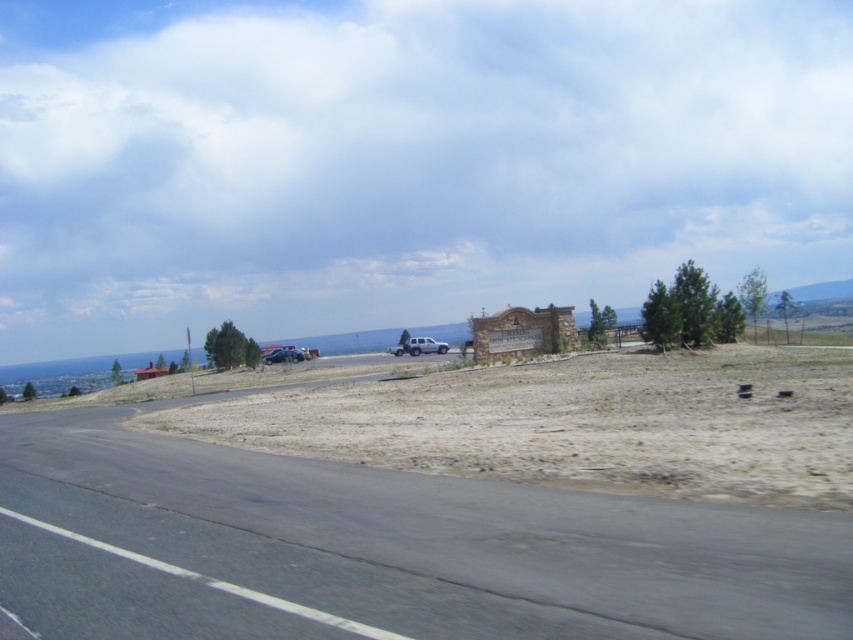
Question: Which point appears farthest from the camera in this image?

Choices:
 (A) pyautogui.click(x=61, y=490)
 (B) pyautogui.click(x=410, y=342)
 (C) pyautogui.click(x=276, y=349)

Answer: (C)

Question: Considering the relative positions of silver metallic truck at center and metallic blue truck at center in the image provided, where is silver metallic truck at center located with respect to metallic blue truck at center?

Choices:
 (A) right
 (B) left

Answer: (A)

Question: Is asphalt road at lower left above silver metallic truck at center?

Choices:
 (A) yes
 (B) no

Answer: (B)

Question: Estimate the real-world distances between objects in this image. Which object is closer to the metallic blue truck at center?

Choices:
 (A) asphalt road at lower left
 (B) silver metallic truck at center

Answer: (B)

Question: Is silver metallic truck at center to the left of metallic blue truck at center from the viewer's perspective?

Choices:
 (A) no
 (B) yes

Answer: (A)

Question: Which of these objects is positioned farthest from the metallic blue truck at center?

Choices:
 (A) asphalt road at lower left
 (B) silver metallic truck at center

Answer: (A)